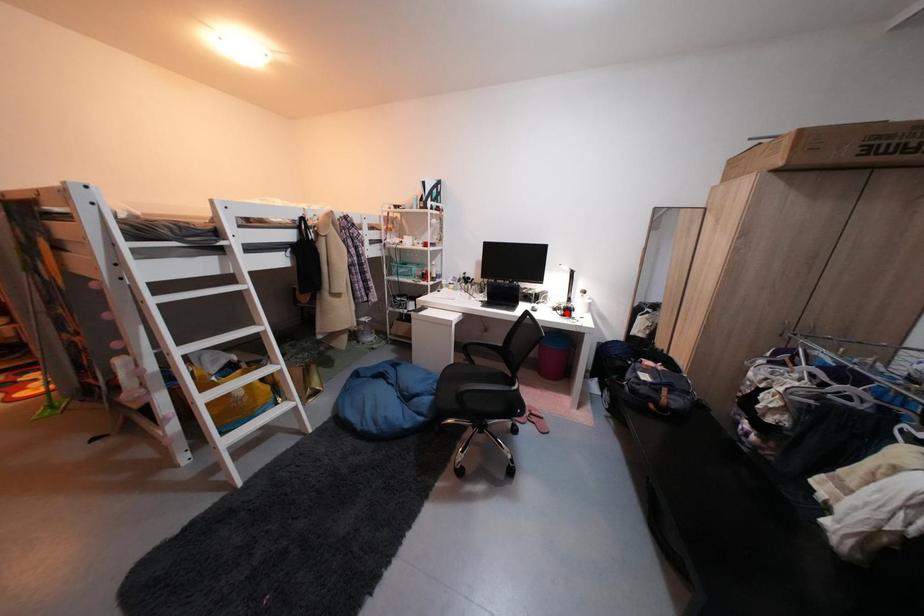
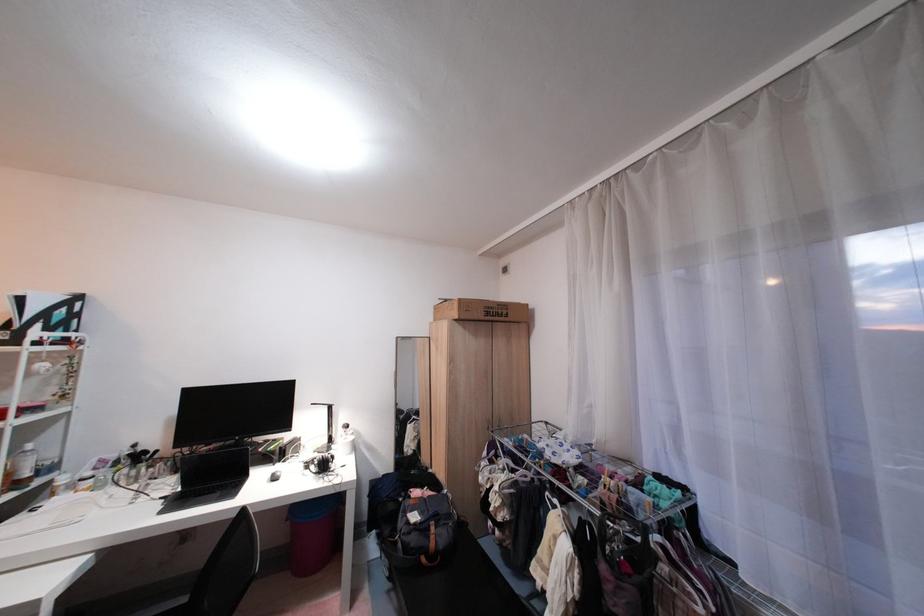
Find the pixel in the second image that matches the highlighted location in the first image.

(320, 472)